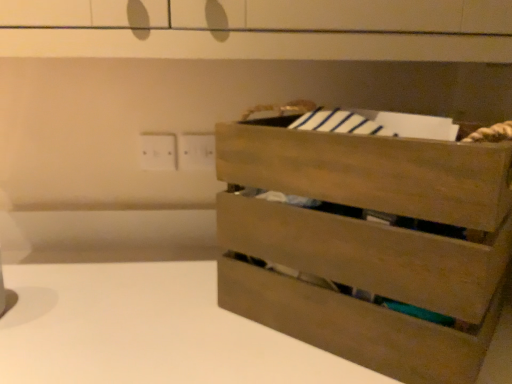
The height and width of the screenshot is (384, 512). Identify the location of natural wood crate at right. (366, 242).

What do you see at coordinates (366, 242) in the screenshot? I see `natural wood crate at right` at bounding box center [366, 242].

In order to click on white plastic electric outlet at upper left in this screenshot , I will do `click(158, 151)`.

This screenshot has height=384, width=512. What do you see at coordinates (158, 151) in the screenshot?
I see `white plastic electric outlet at upper left` at bounding box center [158, 151].

Where is `natural wood crate at right`? natural wood crate at right is located at coordinates (366, 242).

Considering the positions of objects white plastic electric outlet at upper left and natural wood crate at right in the image provided, who is more to the left, white plastic electric outlet at upper left or natural wood crate at right?

white plastic electric outlet at upper left.

Which object is further away from the camera, white plastic electric outlet at upper left or natural wood crate at right?

white plastic electric outlet at upper left is further from the camera.

Is point (164, 159) positioned in front of point (439, 215)?

No.

From the image's perspective, is white plastic electric outlet at upper left located beneath natural wood crate at right?

Incorrect, from the image's perspective, white plastic electric outlet at upper left is higher than natural wood crate at right.

From a real-world perspective, between white plastic electric outlet at upper left and natural wood crate at right, who is vertically higher?

In real-world perspective, white plastic electric outlet at upper left is above.

Does white plastic electric outlet at upper left have a lesser width compared to natural wood crate at right?

Correct, the width of white plastic electric outlet at upper left is less than that of natural wood crate at right.

Between white plastic electric outlet at upper left and natural wood crate at right, which one has less height?

white plastic electric outlet at upper left is shorter.

Does white plastic electric outlet at upper left have a smaller size compared to natural wood crate at right?

Yes.

Is natural wood crate at right inside white plastic electric outlet at upper left?

No, natural wood crate at right is not a part of white plastic electric outlet at upper left.

Is white plastic electric outlet at upper left far from natural wood crate at right?

white plastic electric outlet at upper left is near natural wood crate at right, not far away.

Does white plastic electric outlet at upper left turn towards natural wood crate at right?

No, white plastic electric outlet at upper left is not turned towards natural wood crate at right.

How many degrees apart are the facing directions of white plastic electric outlet at upper left and natural wood crate at right?

The angular difference between white plastic electric outlet at upper left and natural wood crate at right is 38.1 degrees.

This screenshot has width=512, height=384. Identify the location of the chest of drawers located underneath the white plastic electric outlet at upper left (from a real-world perspective). (366, 242).

Which is more to the left, natural wood crate at right or white plastic electric outlet at upper left?

white plastic electric outlet at upper left is more to the left.

Is the depth of natural wood crate at right greater than that of white plastic electric outlet at upper left?

No, it is not.

Considering the positions of points (276, 236) and (176, 149), is point (276, 236) farther from camera compared to point (176, 149)?

No, (276, 236) is in front of (176, 149).

From the image's perspective, who appears lower, natural wood crate at right or white plastic electric outlet at upper left?

natural wood crate at right is shown below in the image.

From a real-world perspective, does natural wood crate at right stand above white plastic electric outlet at upper left?

No.

Between natural wood crate at right and white plastic electric outlet at upper left, which one has smaller width?

white plastic electric outlet at upper left is thinner.

Considering the relative sizes of natural wood crate at right and white plastic electric outlet at upper left in the image provided, is natural wood crate at right taller than white plastic electric outlet at upper left?

Indeed, natural wood crate at right has a greater height compared to white plastic electric outlet at upper left.

Who is bigger, natural wood crate at right or white plastic electric outlet at upper left?

Bigger between the two is natural wood crate at right.

Is natural wood crate at right positioned beyond the bounds of white plastic electric outlet at upper left?

natural wood crate at right is positioned outside white plastic electric outlet at upper left.

Are natural wood crate at right and white plastic electric outlet at upper left far apart?

No, natural wood crate at right is not far from white plastic electric outlet at upper left.

Is natural wood crate at right turned away from white plastic electric outlet at upper left?

natural wood crate at right does not have its back to white plastic electric outlet at upper left.

How different are the orientations of natural wood crate at right and white plastic electric outlet at upper left in degrees?

natural wood crate at right and white plastic electric outlet at upper left are facing 38.1 degrees away from each other.

How far apart are natural wood crate at right and white plastic electric outlet at upper left?

natural wood crate at right is 21.70 inches away from white plastic electric outlet at upper left.

Find the location of `electric outlet above the natural wood crate at right (from the image's perspective)`. electric outlet above the natural wood crate at right (from the image's perspective) is located at coordinates (158, 151).

I want to click on electric outlet behind the natural wood crate at right, so click(x=158, y=151).

Locate an element on the screen. The height and width of the screenshot is (384, 512). chest of drawers in front of the white plastic electric outlet at upper left is located at coordinates (366, 242).